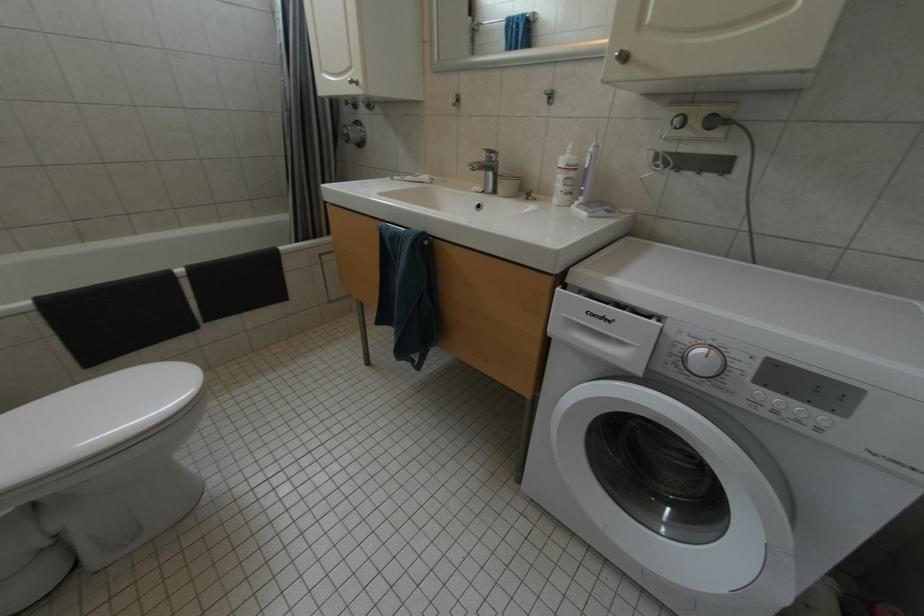
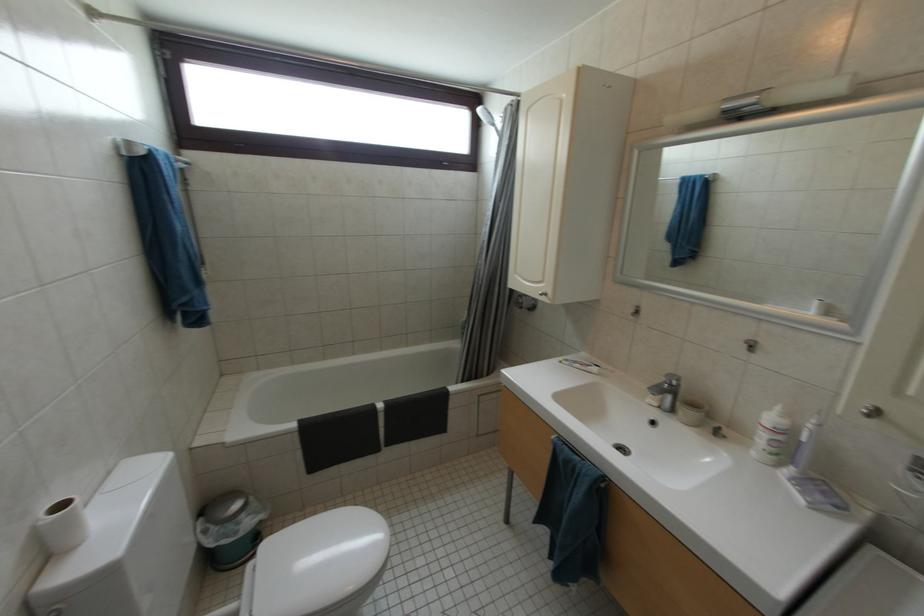
The images are taken continuously from a first-person perspective. In which direction are you moving?

The cameraman walked toward left, backward.